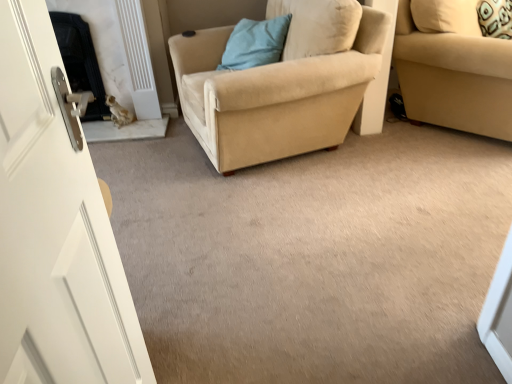
Measure the distance between point (264, 43) and camera.

8.52 feet.

The width and height of the screenshot is (512, 384). Describe the element at coordinates (80, 61) in the screenshot. I see `black marble fireplace at left` at that location.

You are a GUI agent. You are given a task and a screenshot of the screen. Output one action in this format:
    pyautogui.click(x=<x>, y=<y>)
    Task: Click on the beige fabric studio couch at right
    The height and width of the screenshot is (384, 512).
    Given the screenshot: What is the action you would take?
    pyautogui.click(x=453, y=68)

Image resolution: width=512 pixels, height=384 pixels. I want to click on blue fabric pillow at upper center, so click(x=255, y=43).

Considering the sizes of objects beige fabric studio couch at right and black marble fireplace at left in the image provided, who is taller, beige fabric studio couch at right or black marble fireplace at left?

beige fabric studio couch at right is taller.

From the image's perspective, which object appears higher, beige fabric studio couch at right or black marble fireplace at left?

beige fabric studio couch at right is shown above in the image.

Are beige fabric studio couch at right and black marble fireplace at left far apart?

Yes, beige fabric studio couch at right and black marble fireplace at left are quite far apart.

Is beige fabric studio couch at right positioned behind black marble fireplace at left?

That is False.

Is blue fabric pillow at upper center turned away from beige fabric studio couch at right?

blue fabric pillow at upper center is not turned away from beige fabric studio couch at right.

How much distance is there between blue fabric pillow at upper center and beige fabric studio couch at right?

blue fabric pillow at upper center and beige fabric studio couch at right are 37.53 inches apart.

Considering the relative sizes of blue fabric pillow at upper center and beige fabric studio couch at right in the image provided, is blue fabric pillow at upper center wider than beige fabric studio couch at right?

Incorrect, the width of blue fabric pillow at upper center does not surpass that of beige fabric studio couch at right.

How many degrees apart are the facing directions of blue fabric pillow at upper center and beige fabric studio couch at right?

85 degrees.

What's the angular difference between beige fabric studio couch at right and blue fabric pillow at upper center's facing directions?

beige fabric studio couch at right and blue fabric pillow at upper center are facing 85 degrees away from each other.

Which is closer to the camera, (479,116) or (263,49)?

Point (479,116) is closer to the camera than point (263,49).

Who is bigger, beige fabric studio couch at right or blue fabric pillow at upper center?

With larger size is beige fabric studio couch at right.

In the scene shown: Is beige fabric studio couch at right taller than blue fabric pillow at upper center?

Yes, beige fabric studio couch at right is taller than blue fabric pillow at upper center.

Can you tell me how much black marble fireplace at left and beige fabric studio couch at right differ in facing direction?

They differ by 45.1 degrees in their facing directions.

Which is in front, point (66, 33) or point (467, 119)?

The point (467, 119) is closer.

Is black marble fireplace at left oriented towards beige fabric studio couch at right?

No, black marble fireplace at left is not oriented towards beige fabric studio couch at right.

From a real-world perspective, who is located lower, black marble fireplace at left or beige fabric studio couch at right?

From a 3D spatial view, black marble fireplace at left is below.

Considering the points (75, 54) and (322, 57), which point is behind, point (75, 54) or point (322, 57)?

The point (75, 54) is farther from the camera.

From the image's perspective, is black marble fireplace at left above or below beige suede armchair at center?

black marble fireplace at left is above beige suede armchair at center.

Consider the image. Between black marble fireplace at left and beige suede armchair at center, which one has more height?

Standing taller between the two is beige suede armchair at center.

Can you confirm if beige suede armchair at center is taller than blue fabric pillow at upper center?

Indeed, beige suede armchair at center has a greater height compared to blue fabric pillow at upper center.

In the image, is beige suede armchair at center on the left side or the right side of blue fabric pillow at upper center?

beige suede armchair at center is positioned on blue fabric pillow at upper center's right side.

Would you say beige suede armchair at center is inside or outside blue fabric pillow at upper center?

beige suede armchair at center is not inside blue fabric pillow at upper center, it's outside.

Considering the positions of point (290, 16) and point (368, 76), is point (290, 16) closer or farther from the camera than point (368, 76)?

Clearly, point (290, 16) is more distant from the camera than point (368, 76).

From the picture: Considering the sizes of blue fabric pillow at upper center and beige suede armchair at center in the image, is blue fabric pillow at upper center taller or shorter than beige suede armchair at center?

Considering their sizes, blue fabric pillow at upper center has less height than beige suede armchair at center.

Does blue fabric pillow at upper center contain beige suede armchair at center?

No.

Is there a large distance between blue fabric pillow at upper center and beige suede armchair at center?

blue fabric pillow at upper center is actually quite close to beige suede armchair at center.

Image resolution: width=512 pixels, height=384 pixels. Identify the location of fireplace below the beige fabric studio couch at right (from a real-world perspective). (80, 61).

The image size is (512, 384). What are the coordinates of `studio couch that appears in front of the blue fabric pillow at upper center` in the screenshot? It's located at (453, 68).

Based on their spatial positions, is black marble fireplace at left or blue fabric pillow at upper center further from beige suede armchair at center?

black marble fireplace at left.

When comparing their distances from blue fabric pillow at upper center, does beige fabric studio couch at right or black marble fireplace at left seem further?

black marble fireplace at left.

Which object lies nearer to the anchor point black marble fireplace at left, blue fabric pillow at upper center or beige fabric studio couch at right?

blue fabric pillow at upper center is closer to black marble fireplace at left.

Based on their spatial positions, is beige fabric studio couch at right or black marble fireplace at left further from beige suede armchair at center?

Among the two, black marble fireplace at left is located further to beige suede armchair at center.

Based on the photo, which object lies further to the anchor point beige fabric studio couch at right, blue fabric pillow at upper center or beige suede armchair at center?

The object further to beige fabric studio couch at right is blue fabric pillow at upper center.

When comparing their distances from black marble fireplace at left, does beige fabric studio couch at right or blue fabric pillow at upper center seem closer?

Among the two, blue fabric pillow at upper center is located nearer to black marble fireplace at left.

Estimate the real-world distances between objects in this image. Which object is closer to blue fabric pillow at upper center, black marble fireplace at left or beige fabric studio couch at right?

beige fabric studio couch at right is positioned closer to the anchor blue fabric pillow at upper center.

Estimate the real-world distances between objects in this image. Which object is closer to beige fabric studio couch at right, blue fabric pillow at upper center or black marble fireplace at left?

Among the two, blue fabric pillow at upper center is located nearer to beige fabric studio couch at right.

At what (x,y) coordinates should I click in order to perform the action: click on chair situated between blue fabric pillow at upper center and beige fabric studio couch at right from left to right. Please return your answer as a coordinate pair (x, y). The image size is (512, 384). Looking at the image, I should click on (275, 95).

What are the coordinates of `pillow between black marble fireplace at left and beige suede armchair at center` in the screenshot? It's located at (255, 43).

Where is `chair between black marble fireplace at left and beige fabric studio couch at right from left to right`? The image size is (512, 384). chair between black marble fireplace at left and beige fabric studio couch at right from left to right is located at coordinates (275, 95).

In order to click on pillow located between black marble fireplace at left and beige fabric studio couch at right in the left-right direction in this screenshot , I will do coord(255,43).